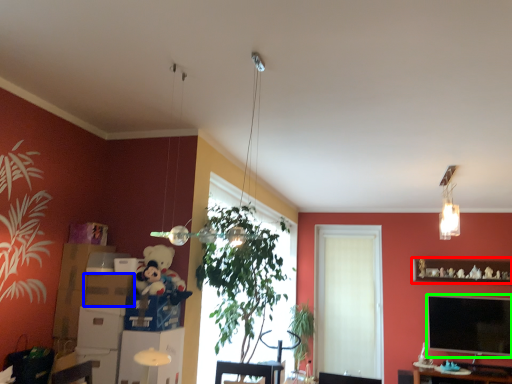
Question: Considering the real-world distances, which object is farthest from shelf (highlighted by a red box)? cardboard box (highlighted by a blue box) or television (highlighted by a green box)?

Choices:
 (A) cardboard box
 (B) television

Answer: (A)